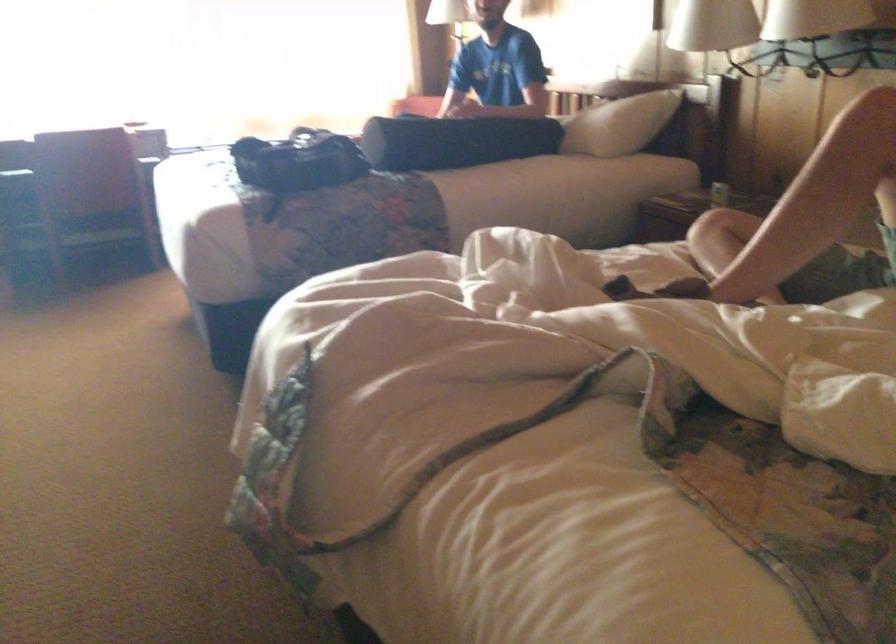
The location [454,140] corresponds to which object?

It corresponds to the black bolster pillow in the image.